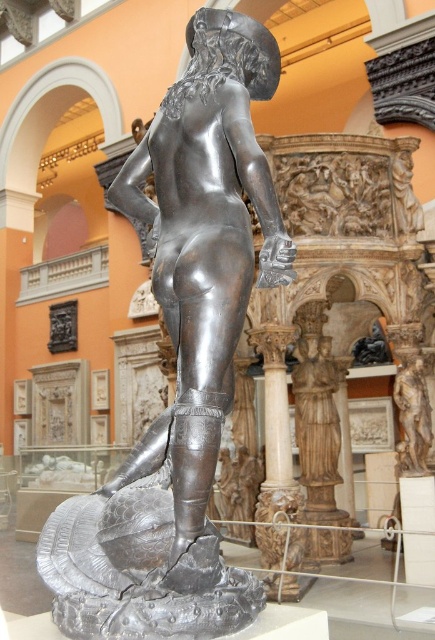
Is the position of polished bronze statue at center less distant than that of polished wood statue at center?

Yes, it is.

Does polished bronze statue at center have a larger size compared to polished wood statue at center?

Indeed, polished bronze statue at center has a larger size compared to polished wood statue at center.

Is point (261, 163) positioned after point (295, 403)?

No, it is not.

This screenshot has width=435, height=640. I want to click on polished bronze statue at center, so click(x=181, y=358).

The image size is (435, 640). What are the coordinates of `polished bronze statue at center` in the screenshot? It's located at (181, 358).

Does polished bronze statue at center appear under bronze statue at center?

No.

Is point (186, 515) closer to viewer compared to point (411, 461)?

Yes, it is in front of point (411, 461).

In order to click on polished bronze statue at center in this screenshot , I will do `click(181, 358)`.

Can you confirm if polished wood statue at center is positioned below bronze statue at center?

Yes.

Is polished wood statue at center above bronze statue at center?

No.

Does point (305, 483) come farther from viewer compared to point (401, 452)?

Yes, it is behind point (401, 452).

Locate an element on the screen. polished wood statue at center is located at coordinates (315, 413).